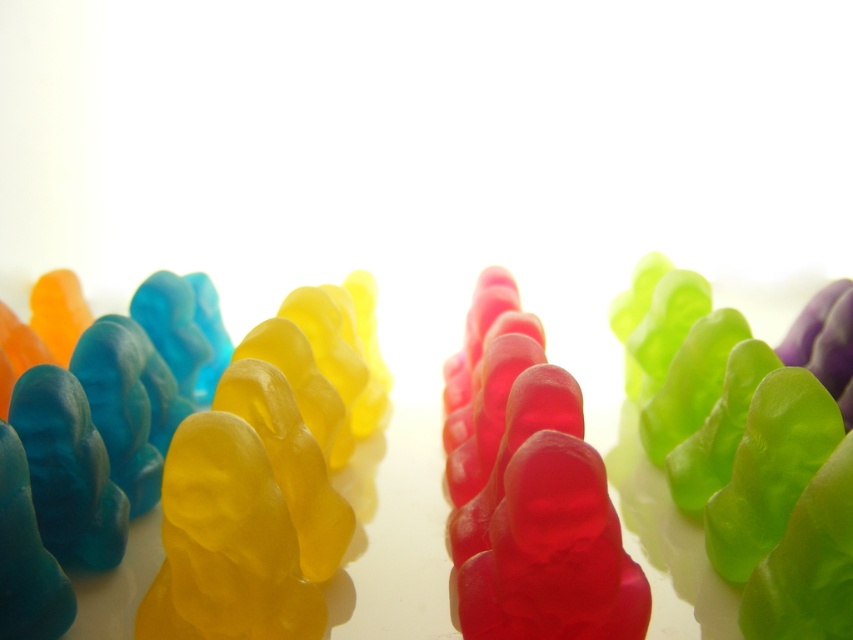
You are a child with small hands trying to pick up candies. You see a translucent gelatin bear at center and a yellow translucent gummy bear at left. Which one is easier to grab?

The translucent gelatin bear at center is easier to grab because its width is larger than the yellow translucent gummy bear at left.

You are a child with a hand span of 3 inches trying to grab both the translucent gelatin bear at center and the yellow translucent gummy bear at left. Can you reach both at the same time?

The translucent gelatin bear at center is 3.31 inches away from the yellow translucent gummy bear at left. Since your hand span is only 3 inches, you cannot reach both at the same time.

You are a child trying to reach for the yellow translucent gummy bear at left and the translucent jelly bear at center. Which one is higher up in the arrangement?

The yellow translucent gummy bear at left is located above the translucent jelly bear at center, so it is higher up in the arrangement.